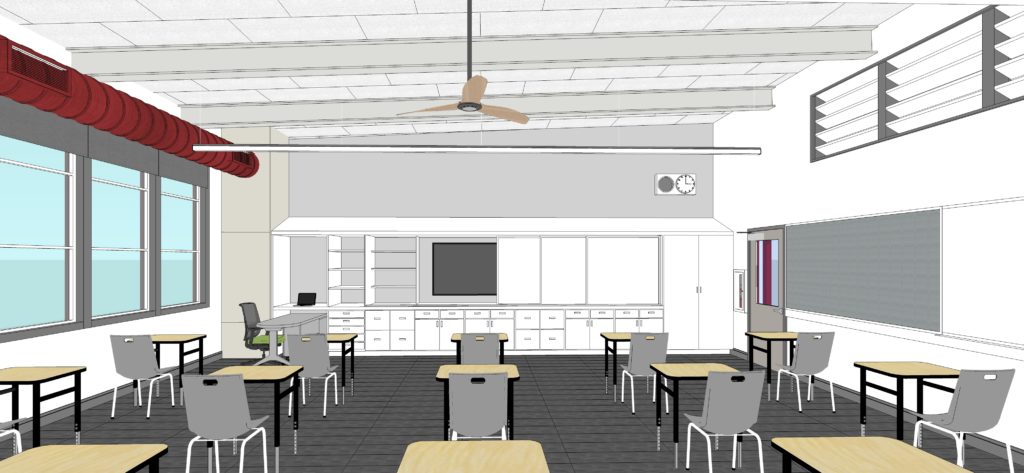
Locate an element on the screen. The height and width of the screenshot is (473, 1024). ceiling fan is located at coordinates 472,104, 471,88.